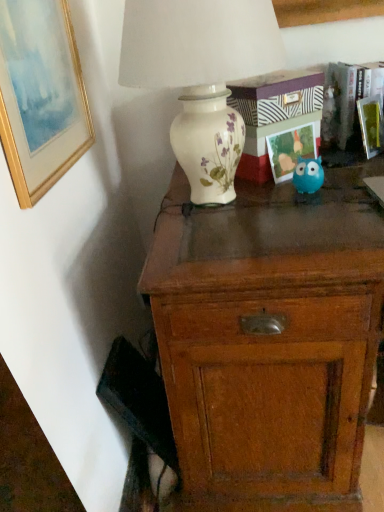
At what (x,y) coordinates should I click in order to perform the action: click on vacant area situated to the left side of blue rubber toy at center. Please return your answer as a coordinate pair (x, y). Looking at the image, I should click on (255, 201).